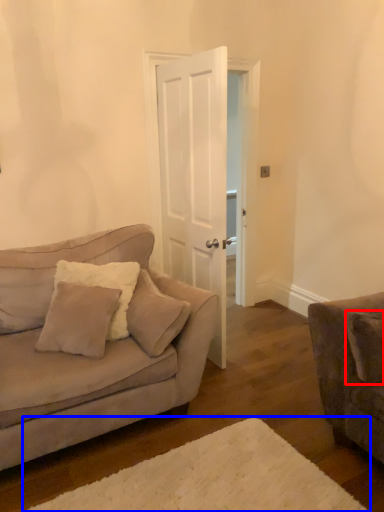
Question: Which object is closer to the camera taking this photo, pillow (highlighted by a red box) or plain (highlighted by a blue box)?

Choices:
 (A) pillow
 (B) plain

Answer: (B)